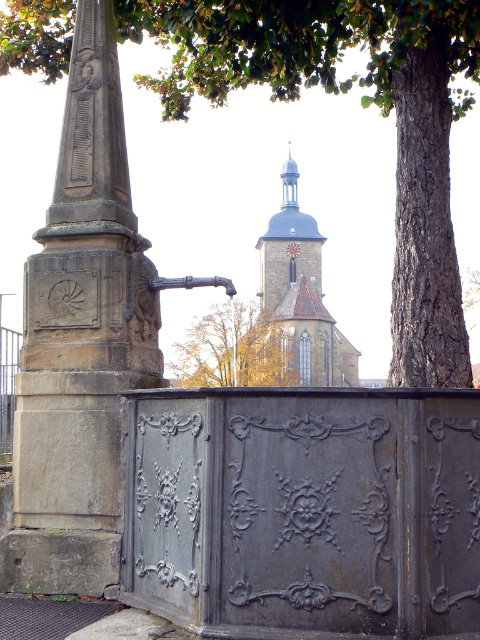
Question: Among these objects, which one is nearest to the camera?

Choices:
 (A) rustic stone fountain at left
 (B) smooth gray stone tower at center
 (C) yellow autumn leaves at center

Answer: (A)

Question: Does brown textured tree at upper right have a smaller size compared to yellow autumn leaves at center?

Choices:
 (A) no
 (B) yes

Answer: (A)

Question: Is brown textured tree at upper right to the right of smooth gray stone tower at center from the viewer's perspective?

Choices:
 (A) no
 (B) yes

Answer: (A)

Question: Can you confirm if smooth gray stone tower at center is positioned to the left of yellow autumn leaves at center?

Choices:
 (A) yes
 (B) no

Answer: (B)

Question: Estimate the real-world distances between objects in this image. Which object is closer to the rustic stone fountain at left?

Choices:
 (A) yellow autumn leaves at center
 (B) brown textured tree at upper right
 (C) smooth gray stone tower at center

Answer: (B)

Question: Which object is positioned farthest from the smooth gray stone tower at center?

Choices:
 (A) rustic stone fountain at left
 (B) brown textured tree at upper right
 (C) yellow autumn leaves at center

Answer: (A)